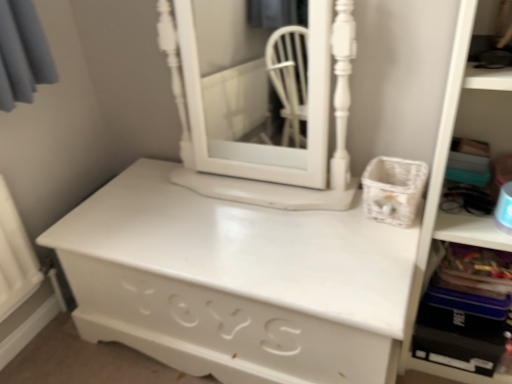
Question: From the image's perspective, does white painted wood medicine cabinet at center appear lower than white matte chest of drawers at center?

Choices:
 (A) yes
 (B) no

Answer: (B)

Question: Is white painted wood medicine cabinet at center wider than white matte chest of drawers at center?

Choices:
 (A) yes
 (B) no

Answer: (B)

Question: Is white painted wood medicine cabinet at center closer to the viewer compared to white matte chest of drawers at center?

Choices:
 (A) yes
 (B) no

Answer: (B)

Question: Is white painted wood medicine cabinet at center thinner than white matte chest of drawers at center?

Choices:
 (A) yes
 (B) no

Answer: (A)

Question: Could you tell me if white painted wood medicine cabinet at center is turned towards white matte chest of drawers at center?

Choices:
 (A) yes
 (B) no

Answer: (B)

Question: Can you confirm if white painted wood medicine cabinet at center is positioned to the left of white matte chest of drawers at center?

Choices:
 (A) no
 (B) yes

Answer: (A)

Question: Is white plastic bookshelf at right positioned with its back to white matte chest of drawers at center?

Choices:
 (A) yes
 (B) no

Answer: (B)

Question: Considering the relative positions of white plastic bookshelf at right and white matte chest of drawers at center in the image provided, is white plastic bookshelf at right behind white matte chest of drawers at center?

Choices:
 (A) yes
 (B) no

Answer: (B)

Question: Does white plastic bookshelf at right have a greater height compared to white matte chest of drawers at center?

Choices:
 (A) yes
 (B) no

Answer: (A)

Question: Is white plastic bookshelf at right positioned before white matte chest of drawers at center?

Choices:
 (A) yes
 (B) no

Answer: (A)

Question: From the image's perspective, would you say white plastic bookshelf at right is shown under white matte chest of drawers at center?

Choices:
 (A) no
 (B) yes

Answer: (A)

Question: From a real-world perspective, is white plastic bookshelf at right located higher than white matte chest of drawers at center?

Choices:
 (A) yes
 (B) no

Answer: (A)

Question: Is white matte chest of drawers at center oriented away from white plastic bookshelf at right?

Choices:
 (A) yes
 (B) no

Answer: (B)